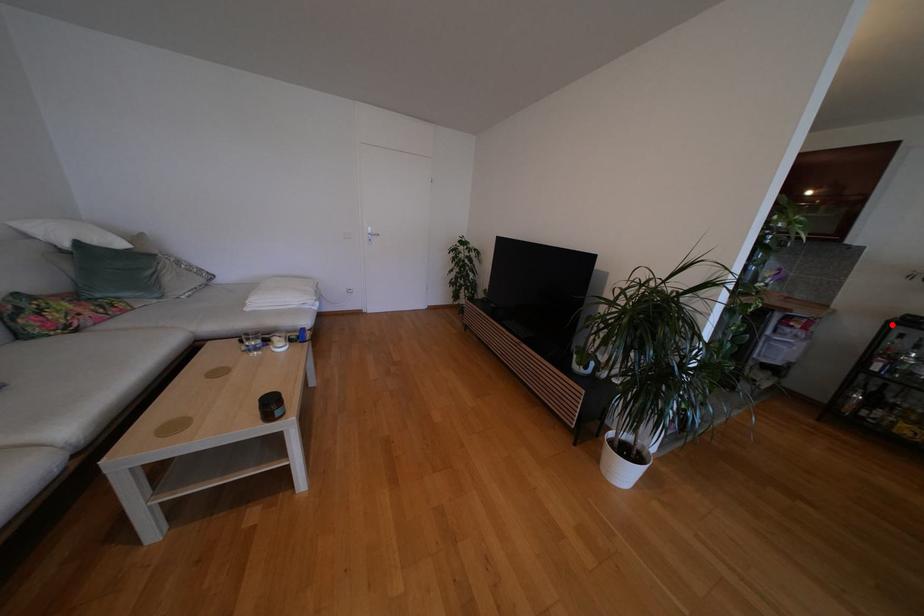
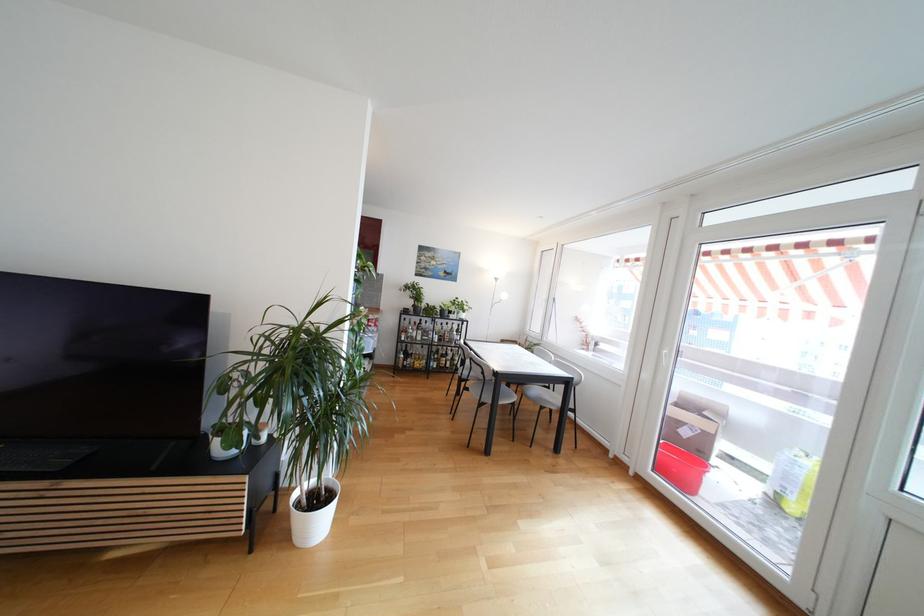
Question: I am providing you with two images of the same scene from different viewpoints. A red point is shown in image1. For the corresponding object point in image2, is it positioned nearer or farther from the camera?

Choices:
 (A) Nearer
 (B) Farther

Answer: (A)